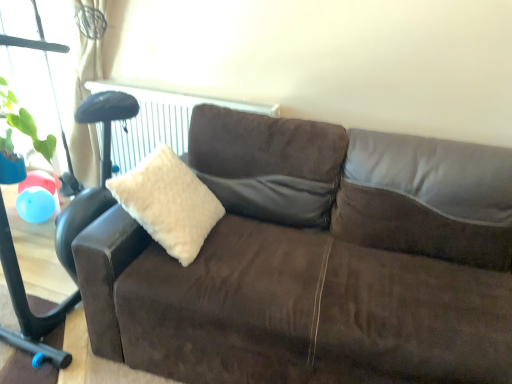
Question: In terms of size, does brown suede couch at center appear bigger or smaller than white fluffy pillow at center?

Choices:
 (A) big
 (B) small

Answer: (A)

Question: Is point (496, 190) closer or farther from the camera than point (192, 182)?

Choices:
 (A) farther
 (B) closer

Answer: (B)

Question: Do you think brown suede couch at center is within white fluffy pillow at center, or outside of it?

Choices:
 (A) inside
 (B) outside

Answer: (B)

Question: From a real-world perspective, relative to brown suede couch at center, is white fluffy pillow at center vertically above or below?

Choices:
 (A) below
 (B) above

Answer: (B)

Question: From the image's perspective, relative to brown suede couch at center, is white fluffy pillow at center above or below?

Choices:
 (A) above
 (B) below

Answer: (A)

Question: Is white fluffy pillow at center taller or shorter than brown suede couch at center?

Choices:
 (A) tall
 (B) short

Answer: (B)

Question: Is white fluffy pillow at center in front of or behind brown suede couch at center in the image?

Choices:
 (A) behind
 (B) front

Answer: (A)